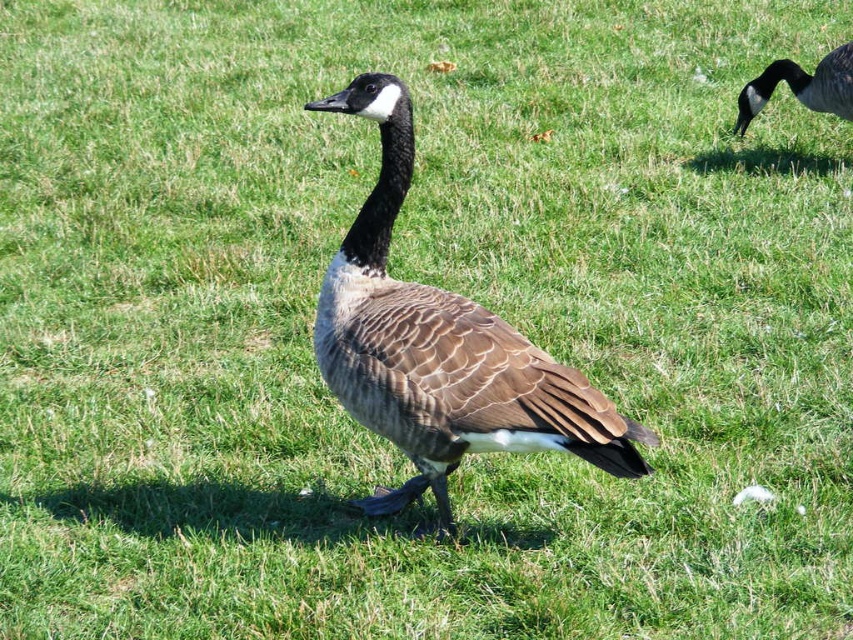
You are a photographer aiming to capture a Canada goose on a grassy field. You notice a point at coordinates point (x=440, y=348). What animal is located at that point?

At point (x=440, y=348) lies brown feathered duck at center.

You are a birdwatcher observing the scene. You notice a brown feathered duck at center and a brown feathered goose at upper right. Which one is positioned higher in the image?

The brown feathered goose at upper right is positioned higher in the image than the brown feathered duck at center.